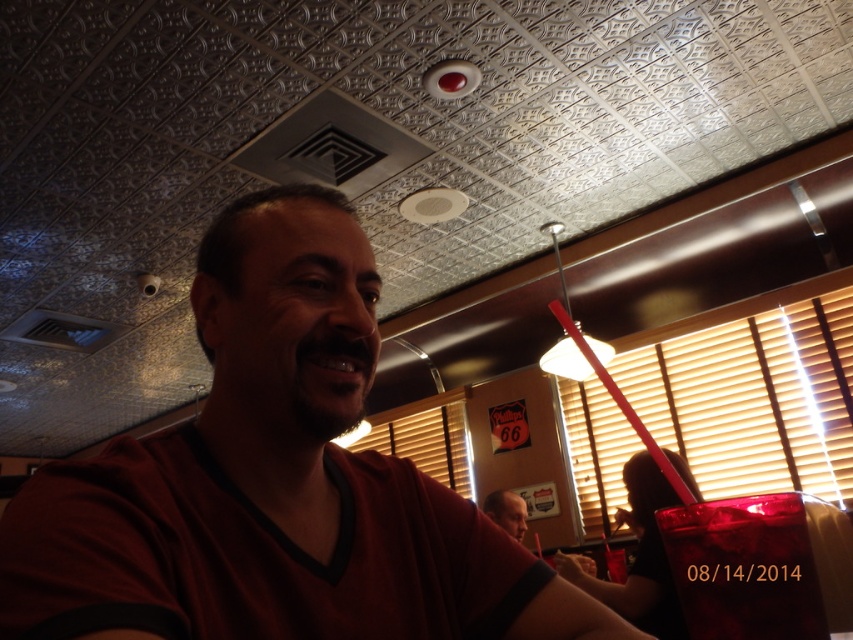
Question: Can you confirm if matte black shirt at center is positioned below translucent plastic cup at lower right?

Choices:
 (A) yes
 (B) no

Answer: (B)

Question: Which point is closer to the camera taking this photo?

Choices:
 (A) (495, 522)
 (B) (622, 563)
 (C) (160, 564)

Answer: (C)

Question: From the image, what is the correct spatial relationship of matte black shirt at center in relation to translucent plastic cup at lower right?

Choices:
 (A) above
 (B) below

Answer: (A)

Question: From the image, what is the correct spatial relationship of matte red shirt at center in relation to matte black shirt at center?

Choices:
 (A) right
 (B) left

Answer: (B)

Question: Among these points, which one is nearest to the camera?

Choices:
 (A) (520, 525)
 (B) (618, 563)
 (C) (300, 632)

Answer: (C)

Question: Which of these objects is positioned farthest from the translucent plastic cup at lower right?

Choices:
 (A) matte black shirt at center
 (B) matte red shirt at center

Answer: (B)